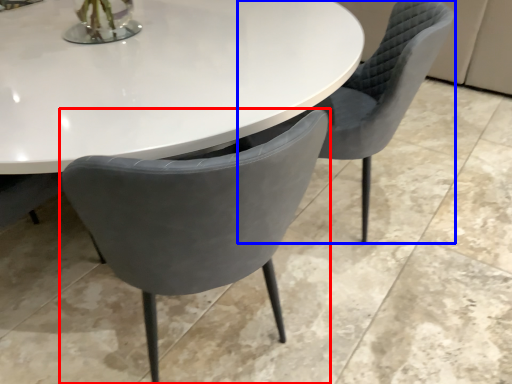
Question: Among these objects, which one is nearest to the camera, chair (highlighted by a red box) or chair (highlighted by a blue box)?

Choices:
 (A) chair
 (B) chair

Answer: (A)